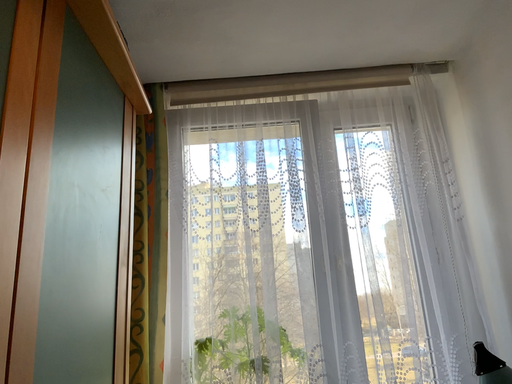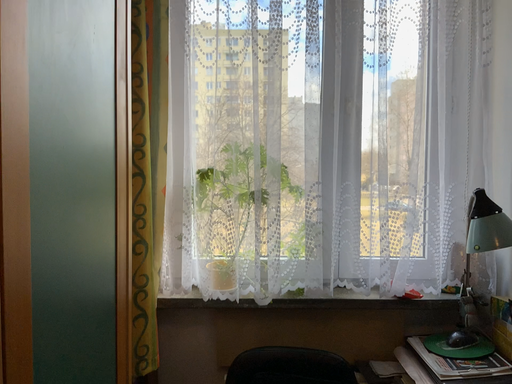
Question: How did the camera likely rotate when shooting the video?

Choices:
 (A) rotated upward
 (B) rotated downward

Answer: (B)